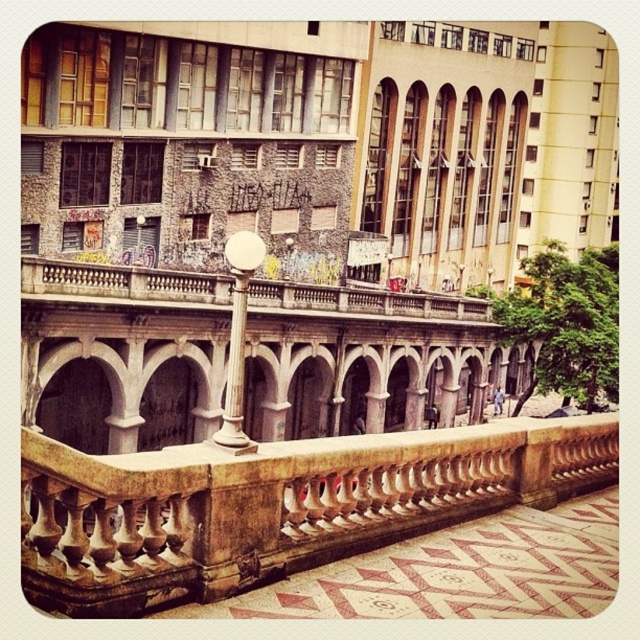
You are standing at the entrance of the walkway and want to reach the lamppost. Which direction should you move relative to the stone balustrade at center?

Since the stone balustrade at center is located at point (275,506), you should move towards it to reach the lamppost near the balustrade.